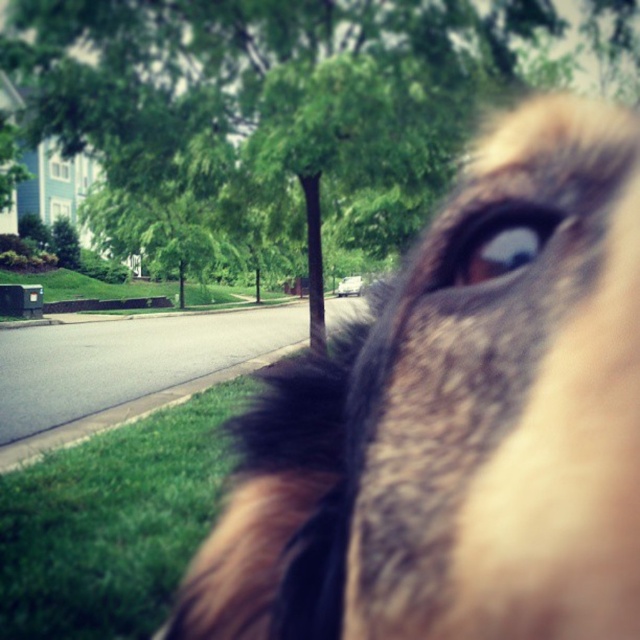
Question: Can you confirm if brown furry dog at upper right is positioned to the right of green leafy tree at center?

Choices:
 (A) yes
 (B) no

Answer: (A)

Question: Does brown furry dog at upper right come in front of brown fur eye at upper right?

Choices:
 (A) no
 (B) yes

Answer: (B)

Question: Estimate the real-world distances between objects in this image. Which object is closer to the green leafy tree at center?

Choices:
 (A) brown furry dog at upper right
 (B) brown fur eye at upper right

Answer: (A)

Question: Among these objects, which one is farthest from the camera?

Choices:
 (A) green leafy tree at center
 (B) brown furry dog at upper right
 (C) brown fur eye at upper right

Answer: (A)

Question: Where is green leafy tree at center located in relation to brown fur eye at upper right in the image?

Choices:
 (A) left
 (B) right

Answer: (A)

Question: Considering the real-world distances, which object is farthest from the brown furry dog at upper right?

Choices:
 (A) brown fur eye at upper right
 (B) green leafy tree at center

Answer: (B)